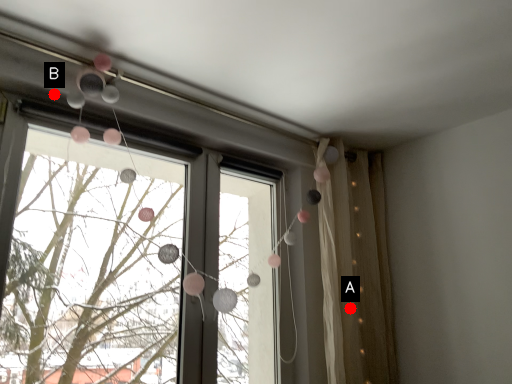
Question: Two points are circled on the image, labeled by A and B beside each circle. Which point appears farthest from the camera in this image?

Choices:
 (A) A is further
 (B) B is further

Answer: (A)